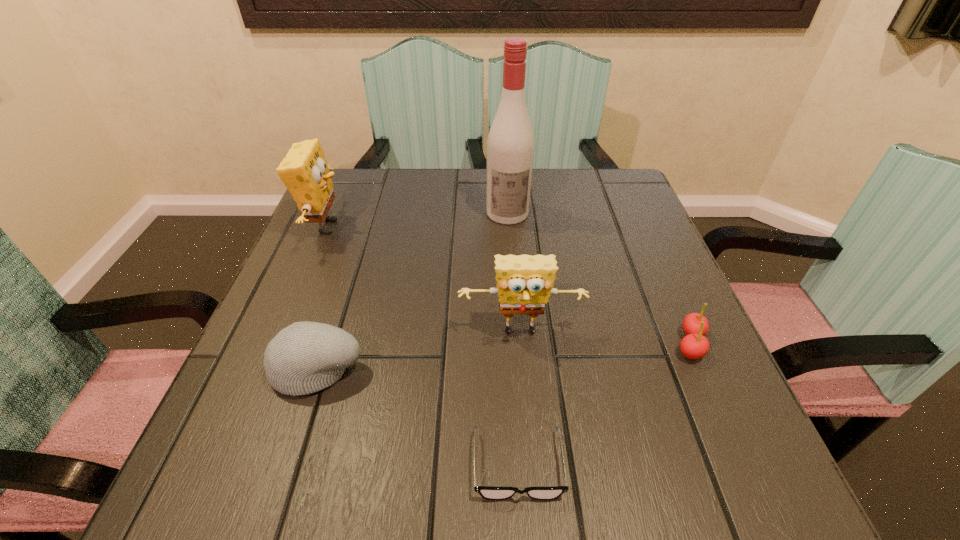
Image resolution: width=960 pixels, height=540 pixels. I want to click on vacant point that satisfies the following two spatial constraints: 1. on the back side of the beanie; 2. on the face of the farther sponge, so click(363, 227).

Locate an element on the screen. The image size is (960, 540). vacant region that satisfies the following two spatial constraints: 1. on the back side of the second shortest object; 2. on the face of the taller sponge is located at coordinates (638, 227).

This screenshot has height=540, width=960. I want to click on free space that satisfies the following two spatial constraints: 1. on the back side of the rightmost object; 2. on the left side of the beanie, so click(x=325, y=344).

Where is `free space that satisfies the following two spatial constraints: 1. on the label of the alcohol; 2. on the face of the farther sponge`? This screenshot has width=960, height=540. free space that satisfies the following two spatial constraints: 1. on the label of the alcohol; 2. on the face of the farther sponge is located at coordinates (509, 227).

The height and width of the screenshot is (540, 960). What are the coordinates of `free space in the image that satisfies the following two spatial constraints: 1. on the face of the second tallest object; 2. on the right side of the fourth tallest object` in the screenshot? It's located at (268, 367).